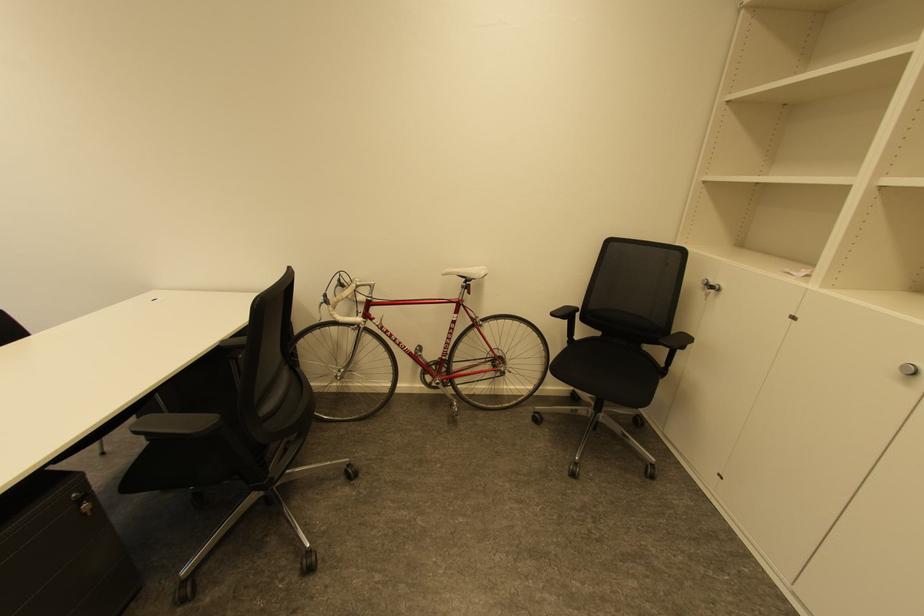
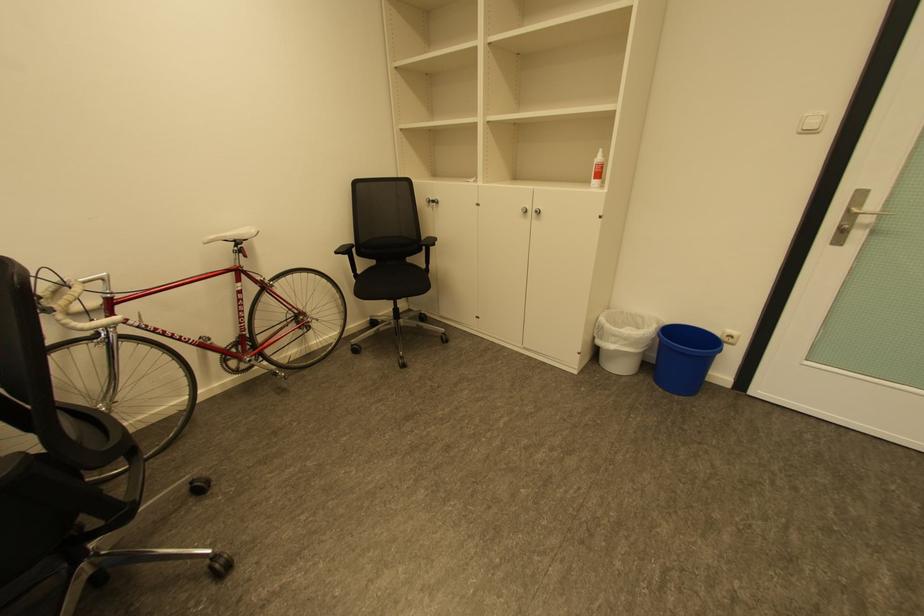
The point at (604,334) is marked in the first image. Where is the corresponding point in the second image?

(380, 262)